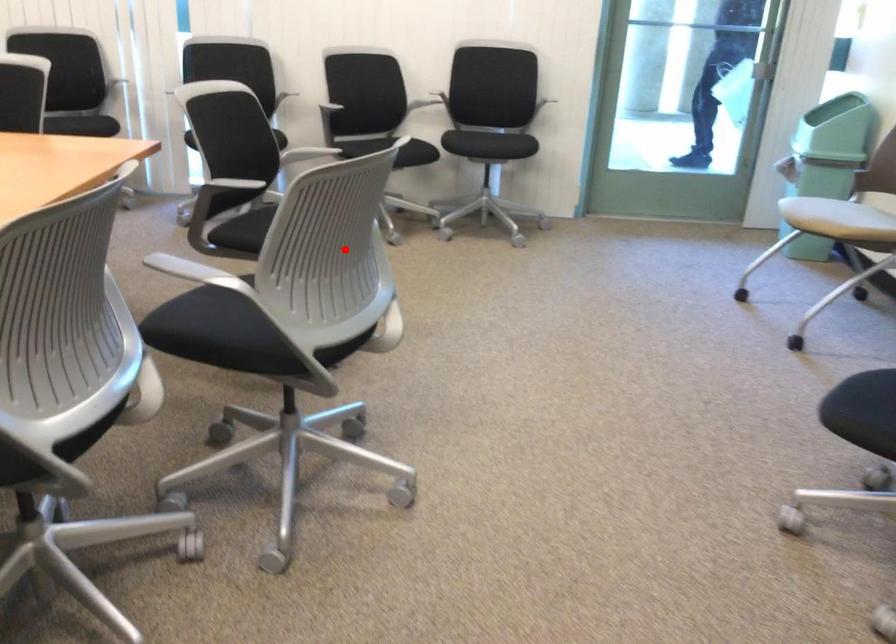
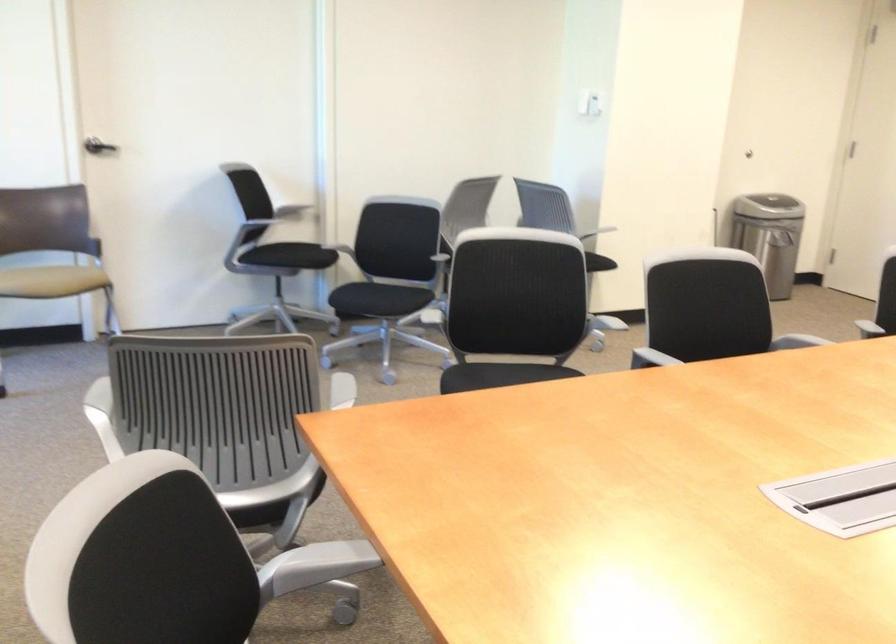
The point at the highlighted location is marked in the first image. Where is the corresponding point in the second image?

(513, 307)